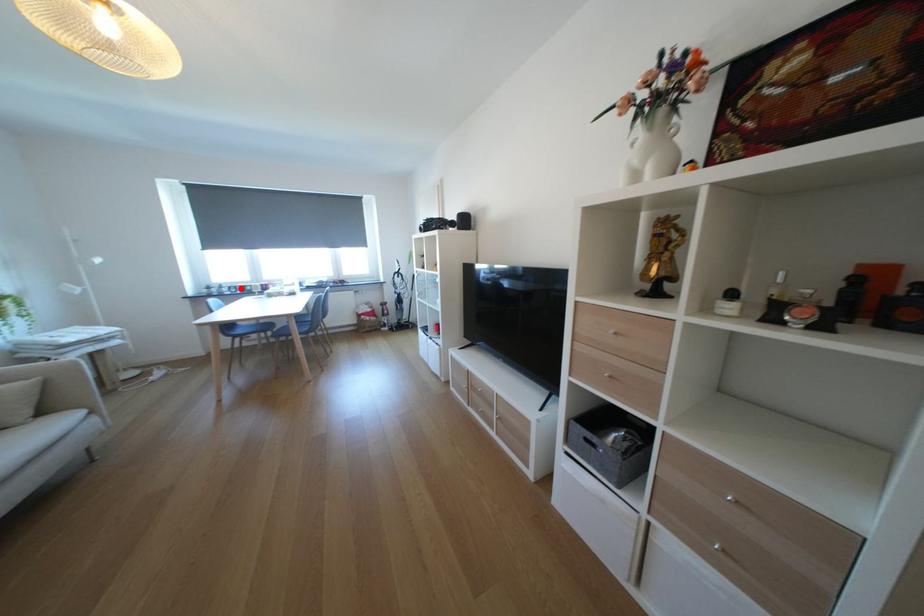
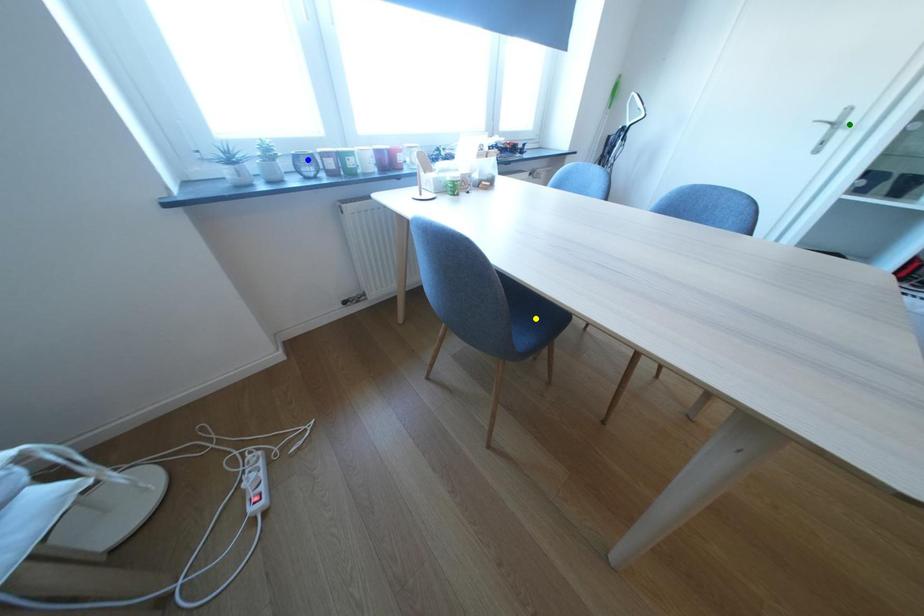
Question: I am providing you with two images of the same scene from different viewpoints. A red point is marked on the first image. You are given multiple points on the second image. Which point in image 2 is actually the same real-world point as the red point in image 1?

Choices:
 (A) green point
 (B) blue point
 (C) yellow point

Answer: (B)